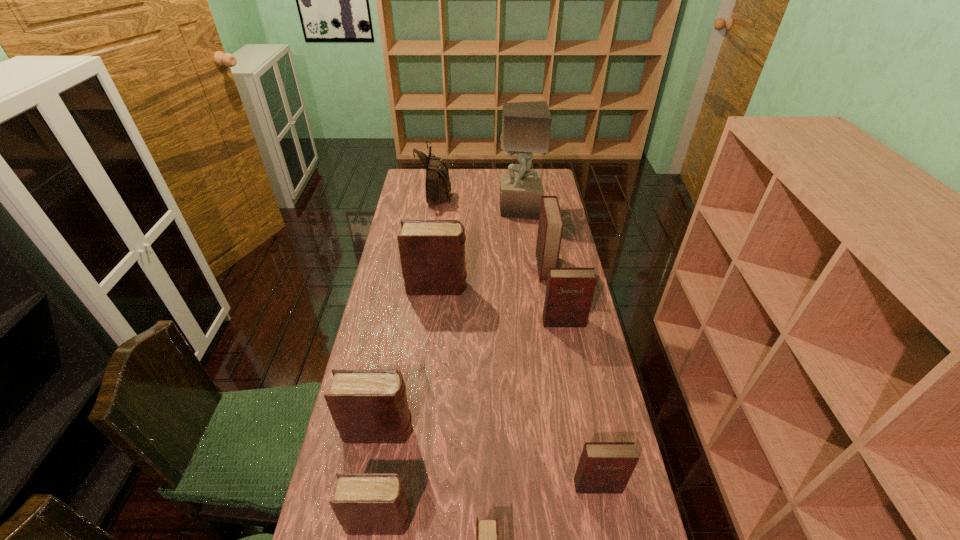
Locate an element on the screen. This screenshot has height=540, width=960. gray sculpture is located at coordinates (526, 126).

Locate an element on the screen. sculpture is located at coordinates (526, 126).

Image resolution: width=960 pixels, height=540 pixels. I want to click on brown shoulder bag, so click(x=438, y=185).

Locate an element on the screen. The height and width of the screenshot is (540, 960). the farthest reddish-brown diary is located at coordinates (550, 228).

At what (x,y) coordinates should I click in order to perform the action: click on the biggest brown diary. Please return your answer as a coordinate pair (x, y). The image size is (960, 540). Looking at the image, I should click on (432, 252).

Identify the location of the fourth nearest diary. This screenshot has width=960, height=540. (367, 406).

I want to click on the second biggest brown diary, so click(367, 406).

The width and height of the screenshot is (960, 540). Identify the location of the second farthest reddish-brown diary. (569, 292).

Locate an element on the screen. The image size is (960, 540). the second biggest reddish-brown diary is located at coordinates (569, 292).

I want to click on the third farthest brown diary, so click(365, 504).